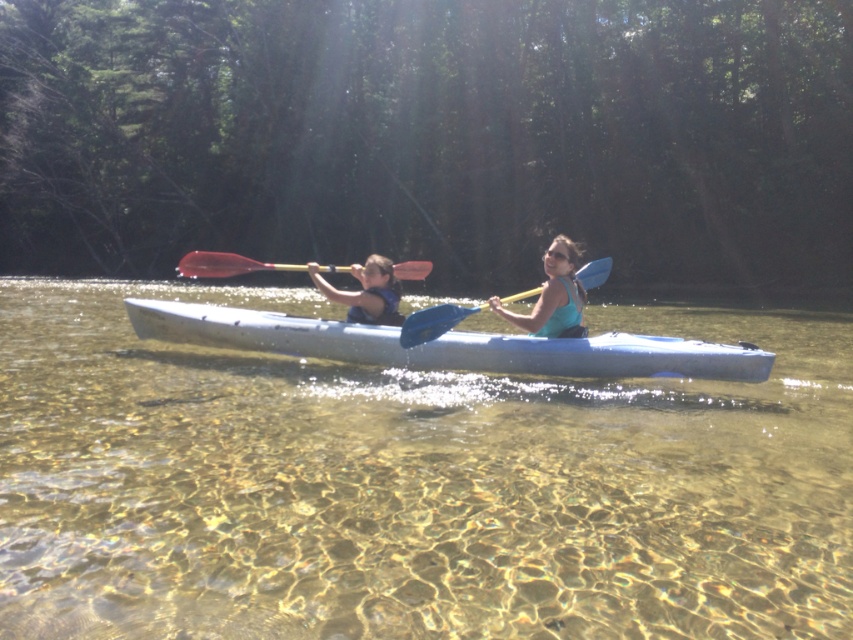
Question: Among these objects, which one is nearest to the camera?

Choices:
 (A) matte blue kayak at center
 (B) yellow plastic paddle at center
 (C) matte blue life vest at center

Answer: (B)

Question: Does clear water at center have a greater width compared to yellow plastic paddle at center?

Choices:
 (A) yes
 (B) no

Answer: (A)

Question: Based on their relative distances, which object is nearer to the matte blue life vest at center?

Choices:
 (A) clear water at center
 (B) matte blue kayak at center
 (C) yellow plastic paddle at center

Answer: (C)

Question: Is matte blue kayak at center above yellow plastic paddle at center?

Choices:
 (A) yes
 (B) no

Answer: (A)

Question: Among these objects, which one is farthest from the camera?

Choices:
 (A) white plastic canoe at center
 (B) clear water at center
 (C) matte blue kayak at center

Answer: (C)

Question: Does matte blue kayak at center lie behind yellow plastic paddle at center?

Choices:
 (A) no
 (B) yes

Answer: (B)